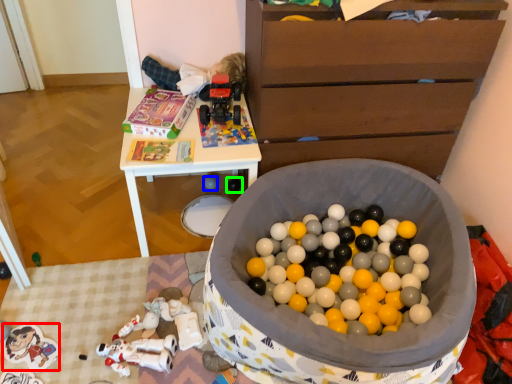
Question: Which is farther away from toy (highlighted by a red box)? toy (highlighted by a blue box) or toy (highlighted by a green box)?

Choices:
 (A) toy
 (B) toy

Answer: (B)